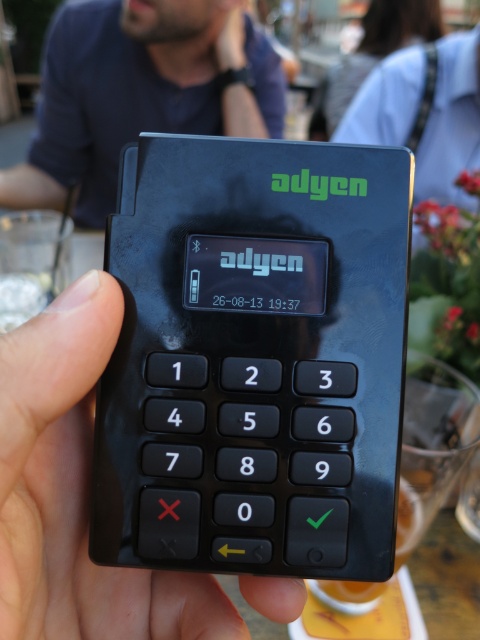
Who is positioned more to the left, black plastic keypad at center or dark blue shirt at upper center?

dark blue shirt at upper center is more to the left.

Is black plastic keypad at center wider than dark blue shirt at upper center?

In fact, black plastic keypad at center might be narrower than dark blue shirt at upper center.

Identify the location of black plastic keypad at center. Image resolution: width=480 pixels, height=640 pixels. (254, 358).

This screenshot has height=640, width=480. What are the coordinates of `black plastic keypad at center` in the screenshot? It's located at (254, 358).

Who is more distant from viewer, (214, 496) or (36, 518)?

Positioned behind is point (214, 496).

Between black plastic keypad at center and black matte keypad at center, which one appears on the left side from the viewer's perspective?

black matte keypad at center

Between point (217, 198) and point (36, 602), which one is positioned behind?

Point (217, 198)

Where is `black plastic keypad at center`? black plastic keypad at center is located at coordinates (254, 358).

Can you confirm if black matte keypad at center is positioned to the left of dark blue shirt at upper center?

In fact, black matte keypad at center is to the right of dark blue shirt at upper center.

Can you confirm if black matte keypad at center is taller than dark blue shirt at upper center?

Incorrect, black matte keypad at center's height is not larger of dark blue shirt at upper center's.

The width and height of the screenshot is (480, 640). What do you see at coordinates (76, 492) in the screenshot?
I see `black matte keypad at center` at bounding box center [76, 492].

Identify the location of black matte keypad at center. The width and height of the screenshot is (480, 640). (76, 492).